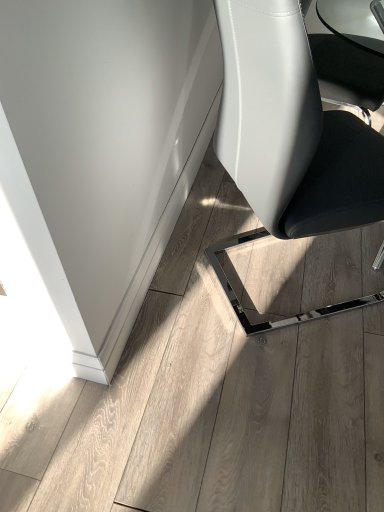
This screenshot has width=384, height=512. Describe the element at coordinates (290, 129) in the screenshot. I see `white leather chair at center` at that location.

Locate an element on the screen. This screenshot has height=512, width=384. white leather chair at center is located at coordinates (290, 129).

In order to face white leather chair at center, should I rotate leftwards or rightwards?

It's best to rotate right around 16.249 degrees.

This screenshot has width=384, height=512. I want to click on white leather chair at center, so point(290,129).